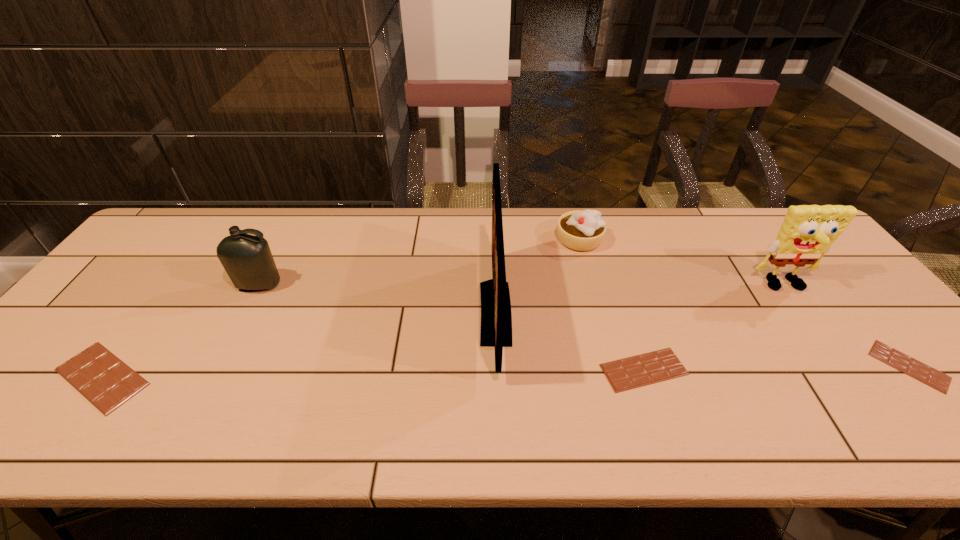
To achieve uniform spacing by inserting another chocolate_bar among them, please point to a free space for this new chocolate_bar. Please provide its 2D coordinates. Your answer should be formatted as a tuple, i.e. [(x, y)], where the tuple contains the x and y coordinates of a point satisfying the conditions above.

[(375, 373)]